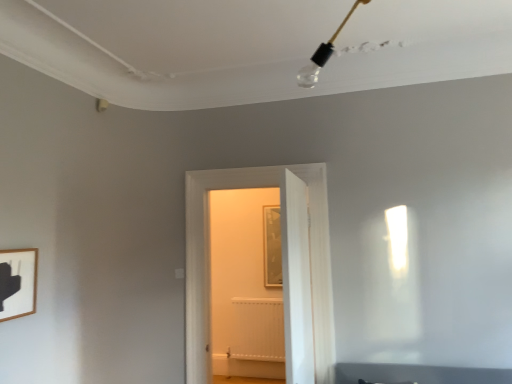
Question: Does wooden picture frame at lower left have a larger size compared to white wooden door at center, the 2th door in the front-to-back sequence?

Choices:
 (A) yes
 (B) no

Answer: (B)

Question: Is wooden picture frame at lower left shorter than white wooden door at center, the 2th door in the front-to-back sequence?

Choices:
 (A) yes
 (B) no

Answer: (A)

Question: Considering the relative sizes of wooden picture frame at lower left and white wooden door at center, the first door positioned from the back, in the image provided, is wooden picture frame at lower left wider than white wooden door at center, the first door positioned from the back,?

Choices:
 (A) yes
 (B) no

Answer: (B)

Question: Does wooden picture frame at lower left have a lesser width compared to white wooden door at center, the first door positioned from the back?

Choices:
 (A) no
 (B) yes

Answer: (B)

Question: Does wooden picture frame at lower left have a smaller size compared to white wooden door at center, the 2th door in the front-to-back sequence?

Choices:
 (A) yes
 (B) no

Answer: (A)

Question: Does point (202, 355) appear closer or farther from the camera than point (281, 314)?

Choices:
 (A) closer
 (B) farther

Answer: (A)

Question: Considering the positions of white wooden door at center, the 2th door in the front-to-back sequence, and white matte radiator at center in the image, is white wooden door at center, the 2th door in the front-to-back sequence, taller or shorter than white matte radiator at center?

Choices:
 (A) short
 (B) tall

Answer: (B)

Question: In the image, is white wooden door at center, the 2th door in the front-to-back sequence, positioned in front of or behind white matte radiator at center?

Choices:
 (A) behind
 (B) front

Answer: (B)

Question: In terms of width, does white wooden door at center, the first door positioned from the back, look wider or thinner when compared to white matte radiator at center?

Choices:
 (A) thin
 (B) wide

Answer: (B)

Question: Is point (303, 223) positioned closer to the camera than point (233, 329)?

Choices:
 (A) farther
 (B) closer

Answer: (B)

Question: Based on their positions, is white wooden door at center, the first door from the front, located to the left or right of white matte radiator at center?

Choices:
 (A) right
 (B) left

Answer: (A)

Question: Is white wooden door at center, the first door from the front, in front of or behind white matte radiator at center in the image?

Choices:
 (A) front
 (B) behind

Answer: (A)

Question: From their relative heights in the image, would you say white wooden door at center, the first door from the front, is taller or shorter than white matte radiator at center?

Choices:
 (A) tall
 (B) short

Answer: (A)

Question: From a real-world perspective, is white wooden door at center, the 2th door in the front-to-back sequence, above or below white wooden door at center, the first door from the front?

Choices:
 (A) above
 (B) below

Answer: (A)

Question: Is white wooden door at center, the first door positioned from the back, situated inside white wooden door at center, the first door from the front, or outside?

Choices:
 (A) outside
 (B) inside

Answer: (A)